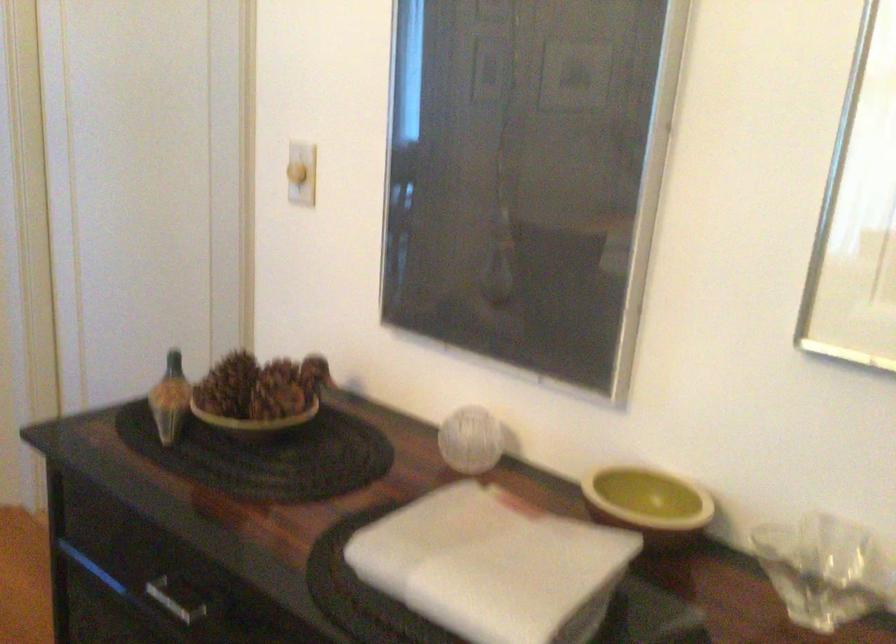
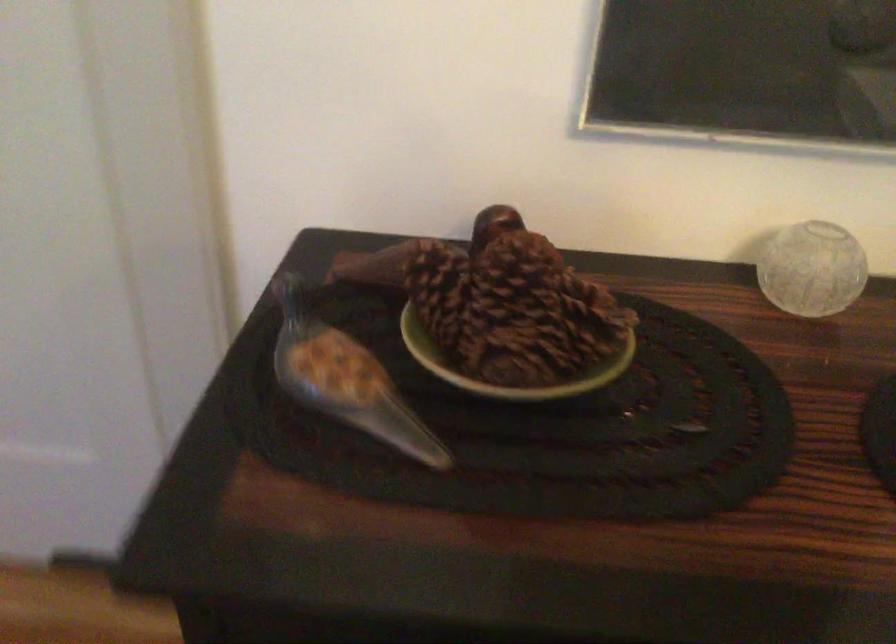
In the second image, find the point that corresponds to [221,382] in the first image.

(440, 292)